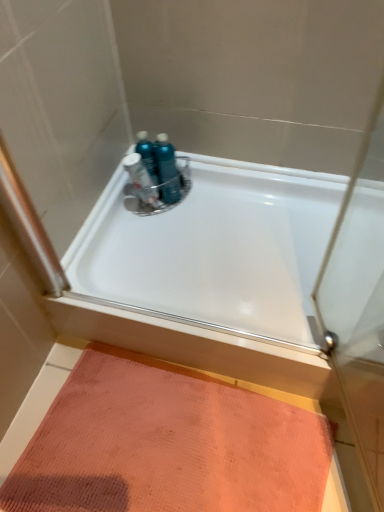
What do you see at coordinates (167, 446) in the screenshot? The height and width of the screenshot is (512, 384). I see `orange textured mat at lower left` at bounding box center [167, 446].

Measure the distance between point (83, 481) and camera.

3.61 feet.

This screenshot has width=384, height=512. What do you see at coordinates (141, 180) in the screenshot?
I see `translucent plastic bottles at center, which is the first toiletry from left to right` at bounding box center [141, 180].

In the scene shown: Measure the distance between blue glossy bottles at upper center, the second toiletry positioned from the right, and camera.

blue glossy bottles at upper center, the second toiletry positioned from the right, and camera are 4.57 feet apart from each other.

Find the location of a particular element. This screenshot has width=384, height=512. white glossy bathtub at center is located at coordinates (210, 274).

Choose the correct answer: Is white glossy bathtub at center inside teal plastic bottles at center, the third toiletry viewed from the left, or outside it?

white glossy bathtub at center is spatially situated outside teal plastic bottles at center, the third toiletry viewed from the left.

Considering the sizes of objects white glossy bathtub at center and teal plastic bottles at center, positioned as the first toiletry in right-to-left order, in the image provided, who is bigger, white glossy bathtub at center or teal plastic bottles at center, positioned as the first toiletry in right-to-left order,?

With larger size is white glossy bathtub at center.

Image resolution: width=384 pixels, height=512 pixels. Find the location of `bathtub in front of the teal plastic bottles at center, the third toiletry viewed from the left`. bathtub in front of the teal plastic bottles at center, the third toiletry viewed from the left is located at coordinates (210, 274).

Which object is thinner, white glossy bathtub at center or teal plastic bottles at center, positioned as the first toiletry in right-to-left order?

With smaller width is teal plastic bottles at center, positioned as the first toiletry in right-to-left order.

Can you tell me how much teal plastic bottles at center, positioned as the first toiletry in right-to-left order, and white glossy bathtub at center differ in facing direction?

The facing directions of teal plastic bottles at center, positioned as the first toiletry in right-to-left order, and white glossy bathtub at center are 1.5 degrees apart.

From a real-world perspective, relative to white glossy bathtub at center, is teal plastic bottles at center, positioned as the first toiletry in right-to-left order, vertically above or below?

teal plastic bottles at center, positioned as the first toiletry in right-to-left order, is situated higher than white glossy bathtub at center in the real world.

Looking at this image, who is bigger, teal plastic bottles at center, positioned as the first toiletry in right-to-left order, or white glossy bathtub at center?

white glossy bathtub at center.

How many degrees apart are the facing directions of white glossy bathtub at center and orange textured mat at lower left?

The angular difference between white glossy bathtub at center and orange textured mat at lower left is 1.24 degrees.

Considering the positions of objects white glossy bathtub at center and orange textured mat at lower left in the image provided, who is more to the left, white glossy bathtub at center or orange textured mat at lower left?

orange textured mat at lower left.

Does white glossy bathtub at center touch orange textured mat at lower left?

They are not placed beside each other.

From the image's perspective, would you say white glossy bathtub at center is positioned over orange textured mat at lower left?

Yes.

Would you consider white glossy bathtub at center to be distant from blue glossy bottles at upper center, the second toiletry positioned from the right?

They are positioned close to each other.

Between white glossy bathtub at center and blue glossy bottles at upper center, which is counted as the second toiletry, starting from the left, which one appears on the left side from the viewer's perspective?

Positioned to the left is blue glossy bottles at upper center, which is counted as the second toiletry, starting from the left.

From their relative heights in the image, would you say white glossy bathtub at center is taller or shorter than blue glossy bottles at upper center, the second toiletry positioned from the right?

In the image, white glossy bathtub at center appears to be shorter than blue glossy bottles at upper center, the second toiletry positioned from the right.

Can you confirm if white glossy bathtub at center is thinner than blue glossy bottles at upper center, the second toiletry positioned from the right?

No.

Is teal plastic bottles at center, positioned as the first toiletry in right-to-left order, spatially inside orange textured mat at lower left, or outside of it?

teal plastic bottles at center, positioned as the first toiletry in right-to-left order, lies outside orange textured mat at lower left.

In the scene shown: Who is bigger, teal plastic bottles at center, the third toiletry viewed from the left, or orange textured mat at lower left?

orange textured mat at lower left.

Is teal plastic bottles at center, the third toiletry viewed from the left, oriented away from orange textured mat at lower left?

teal plastic bottles at center, the third toiletry viewed from the left, is not turned away from orange textured mat at lower left.

Is point (160, 141) farther from viewer compared to point (113, 393)?

Yes, point (160, 141) is farther from viewer.

Is point (158, 150) positioned before point (149, 165)?

Yes, it is in front of point (149, 165).

Considering the sizes of objects teal plastic bottles at center, the third toiletry viewed from the left, and blue glossy bottles at upper center, which is counted as the second toiletry, starting from the left, in the image provided, who is thinner, teal plastic bottles at center, the third toiletry viewed from the left, or blue glossy bottles at upper center, which is counted as the second toiletry, starting from the left,?

blue glossy bottles at upper center, which is counted as the second toiletry, starting from the left.

Based on their sizes in the image, would you say teal plastic bottles at center, the third toiletry viewed from the left, is bigger or smaller than blue glossy bottles at upper center, the second toiletry positioned from the right?

Considering their sizes, teal plastic bottles at center, the third toiletry viewed from the left, takes up more space than blue glossy bottles at upper center, the second toiletry positioned from the right.

Which toiletry is the 1st one when counting from the front of the blue glossy bottles at upper center, the second toiletry positioned from the right? Please provide its 2D coordinates.

[(167, 169)]

In the image, is teal plastic bottles at center, positioned as the first toiletry in right-to-left order, positioned in front of or behind translucent plastic bottles at center, which is the first toiletry from left to right?

In the image, teal plastic bottles at center, positioned as the first toiletry in right-to-left order, appears behind translucent plastic bottles at center, which is the first toiletry from left to right.

Based on the photo, in terms of width, does teal plastic bottles at center, the third toiletry viewed from the left, look wider or thinner when compared to translucent plastic bottles at center, which is the first toiletry from left to right?

In the image, teal plastic bottles at center, the third toiletry viewed from the left, appears to be wider than translucent plastic bottles at center, which is the first toiletry from left to right.

Can you tell me how much teal plastic bottles at center, the third toiletry viewed from the left, and translucent plastic bottles at center, positioned as the third toiletry in right-to-left order, differ in facing direction?

The angular difference between teal plastic bottles at center, the third toiletry viewed from the left, and translucent plastic bottles at center, positioned as the third toiletry in right-to-left order, is 0.000652 degrees.

In the image, there is a teal plastic bottles at center, positioned as the first toiletry in right-to-left order. Identify the location of bathtub below it (from a real-world perspective). This screenshot has width=384, height=512. (210, 274).

Where is `bathtub that appears below the teal plastic bottles at center, positioned as the first toiletry in right-to-left order (from the image's perspective)`? bathtub that appears below the teal plastic bottles at center, positioned as the first toiletry in right-to-left order (from the image's perspective) is located at coordinates (210, 274).

When comparing their distances from white glossy bathtub at center, does orange textured mat at lower left or blue glossy bottles at upper center, which is counted as the second toiletry, starting from the left, seem further?

Among the two, blue glossy bottles at upper center, which is counted as the second toiletry, starting from the left, is located further to white glossy bathtub at center.

Estimate the real-world distances between objects in this image. Which object is closer to white glossy bathtub at center, blue glossy bottles at upper center, which is counted as the second toiletry, starting from the left, or translucent plastic bottles at center, positioned as the third toiletry in right-to-left order?

translucent plastic bottles at center, positioned as the third toiletry in right-to-left order.

Which object lies further to the anchor point white glossy bathtub at center, teal plastic bottles at center, positioned as the first toiletry in right-to-left order, or blue glossy bottles at upper center, which is counted as the second toiletry, starting from the left?

Among the two, blue glossy bottles at upper center, which is counted as the second toiletry, starting from the left, is located further to white glossy bathtub at center.

Looking at the image, which one is located further to translucent plastic bottles at center, positioned as the third toiletry in right-to-left order, teal plastic bottles at center, the third toiletry viewed from the left, or orange textured mat at lower left?

Among the two, orange textured mat at lower left is located further to translucent plastic bottles at center, positioned as the third toiletry in right-to-left order.

When comparing their distances from white glossy bathtub at center, does translucent plastic bottles at center, which is the first toiletry from left to right, or orange textured mat at lower left seem closer?

Among the two, orange textured mat at lower left is located nearer to white glossy bathtub at center.

From the image, which object appears to be farther from blue glossy bottles at upper center, the second toiletry positioned from the right, orange textured mat at lower left or white glossy bathtub at center?

orange textured mat at lower left.

In the scene shown: From the image, which object appears to be farther from teal plastic bottles at center, the third toiletry viewed from the left, white glossy bathtub at center or translucent plastic bottles at center, positioned as the third toiletry in right-to-left order?

white glossy bathtub at center lies further to teal plastic bottles at center, the third toiletry viewed from the left, than the other object.

When comparing their distances from translucent plastic bottles at center, which is the first toiletry from left to right, does white glossy bathtub at center or teal plastic bottles at center, the third toiletry viewed from the left, seem closer?

Among the two, teal plastic bottles at center, the third toiletry viewed from the left, is located nearer to translucent plastic bottles at center, which is the first toiletry from left to right.

Where is `bathtub between translucent plastic bottles at center, which is the first toiletry from left to right, and orange textured mat at lower left, in the vertical direction`? Image resolution: width=384 pixels, height=512 pixels. bathtub between translucent plastic bottles at center, which is the first toiletry from left to right, and orange textured mat at lower left, in the vertical direction is located at coordinates (210, 274).

This screenshot has height=512, width=384. Identify the location of toiletry between translucent plastic bottles at center, positioned as the third toiletry in right-to-left order, and teal plastic bottles at center, the third toiletry viewed from the left, in the horizontal direction. (147, 156).

Identify the location of toiletry between teal plastic bottles at center, the third toiletry viewed from the left, and orange textured mat at lower left from top to bottom. (141, 180).

I want to click on bathtub between teal plastic bottles at center, positioned as the first toiletry in right-to-left order, and orange textured mat at lower left in the up-down direction, so click(210, 274).